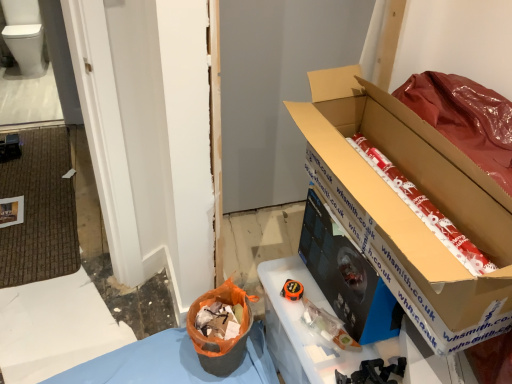
The width and height of the screenshot is (512, 384). Find the location of `cardboard box at right`. cardboard box at right is located at coordinates (409, 208).

Where is `white glossy toilet bowl at upper left`? This screenshot has height=384, width=512. white glossy toilet bowl at upper left is located at coordinates point(26,47).

Measure the distance between point (411,207) and camera.

Point (411,207) and camera are 37.28 inches apart.

The image size is (512, 384). Describe the element at coordinates (423, 208) in the screenshot. I see `red wrapping paper at right` at that location.

Where is `cardboard box at right`? The width and height of the screenshot is (512, 384). cardboard box at right is located at coordinates tap(409, 208).

Is point (29, 68) farther from camera compared to point (459, 233)?

That is True.

Where is `food in front of the white glossy toilet bowl at upper left`? food in front of the white glossy toilet bowl at upper left is located at coordinates (423, 208).

From a real-world perspective, is white glossy toilet bowl at upper left above or below red wrapping paper at right?

white glossy toilet bowl at upper left is situated lower than red wrapping paper at right in the real world.

Does red wrapping paper at right touch white glossy toilet bowl at upper left?

No, red wrapping paper at right is not beside white glossy toilet bowl at upper left.

From a real-world perspective, is red wrapping paper at right positioned under white glossy toilet bowl at upper left based on gravity?

No, from a real-world perspective, red wrapping paper at right is not below white glossy toilet bowl at upper left.

Considering the relative sizes of cardboard box at right and orange fabric bag at lower center in the image provided, is cardboard box at right thinner than orange fabric bag at lower center?

No.

Can you tell me how much cardboard box at right and orange fabric bag at lower center differ in facing direction?

The angular difference between cardboard box at right and orange fabric bag at lower center is 96.5 degrees.

From a real-world perspective, is cardboard box at right positioned above or below orange fabric bag at lower center?

Clearly, from a real-world perspective, cardboard box at right is above orange fabric bag at lower center.

Does cardboard box at right have a larger size compared to orange fabric bag at lower center?

Indeed, cardboard box at right has a larger size compared to orange fabric bag at lower center.

Is cardboard box at right shorter than red wrapping paper at right?

Incorrect, the height of cardboard box at right does not fall short of that of red wrapping paper at right.

From a real-world perspective, is cardboard box at right located higher than red wrapping paper at right?

Correct, in the physical world, cardboard box at right is higher than red wrapping paper at right.

Considering the positions of point (412, 136) and point (383, 176), is point (412, 136) closer or farther from the camera than point (383, 176)?

Point (412, 136).

Looking at this image, measure the distance from cardboard box at right to red wrapping paper at right.

cardboard box at right and red wrapping paper at right are 4.06 inches apart.

Consider the image. Does white glossy toilet bowl at upper left have a larger size compared to orange fabric bag at lower center?

Indeed, white glossy toilet bowl at upper left has a larger size compared to orange fabric bag at lower center.

Does white glossy toilet bowl at upper left have a greater width compared to orange fabric bag at lower center?

Indeed, white glossy toilet bowl at upper left has a greater width compared to orange fabric bag at lower center.

In the scene shown: Is white glossy toilet bowl at upper left turned away from orange fabric bag at lower center?

No, white glossy toilet bowl at upper left is not facing the opposite direction of orange fabric bag at lower center.

Measure the distance from cardboard box at right to white glossy toilet bowl at upper left.

cardboard box at right is 14.93 feet away from white glossy toilet bowl at upper left.

From the image's perspective, is cardboard box at right located above white glossy toilet bowl at upper left?

No.

Is cardboard box at right taller or shorter than white glossy toilet bowl at upper left?

In the image, cardboard box at right appears to be shorter than white glossy toilet bowl at upper left.

Could you tell me if cardboard box at right is turned towards white glossy toilet bowl at upper left?

No, cardboard box at right is not oriented towards white glossy toilet bowl at upper left.

Is orange fabric bag at lower center taller or shorter than cardboard box at right?

In the image, orange fabric bag at lower center appears to be shorter than cardboard box at right.

Which is farther, [206,353] or [416,118]?

Point [206,353]

Based on the photo, is orange fabric bag at lower center aimed at cardboard box at right?

No.

Based on the photo, from a real-world perspective, is orange fabric bag at lower center located higher than cardboard box at right?

Actually, orange fabric bag at lower center is physically below cardboard box at right in the real world.

The height and width of the screenshot is (384, 512). I want to click on toilet bowl above the red wrapping paper at right (from the image's perspective), so click(26, 47).

You are a GUI agent. You are given a task and a screenshot of the screen. Output one action in this format:
    pyautogui.click(x=<x>, y=<y>)
    Task: Click on the food that appears on the right of white glossy toilet bowl at upper left
    The height and width of the screenshot is (384, 512).
    Given the screenshot: What is the action you would take?
    pyautogui.click(x=423, y=208)

Looking at the image, which one is located further to red wrapping paper at right, orange fabric bag at lower center or white glossy toilet bowl at upper left?

Based on the image, white glossy toilet bowl at upper left appears to be further to red wrapping paper at right.

When comparing their distances from white glossy toilet bowl at upper left, does orange fabric bag at lower center or cardboard box at right seem further?

The object further to white glossy toilet bowl at upper left is cardboard box at right.

Estimate the real-world distances between objects in this image. Which object is further from cardboard box at right, red wrapping paper at right or orange fabric bag at lower center?

orange fabric bag at lower center.

Estimate the real-world distances between objects in this image. Which object is further from red wrapping paper at right, orange fabric bag at lower center or cardboard box at right?

orange fabric bag at lower center is positioned further to the anchor red wrapping paper at right.

Looking at this image, which object lies nearer to the anchor point red wrapping paper at right, white glossy toilet bowl at upper left or cardboard box at right?

cardboard box at right is closer to red wrapping paper at right.

From the image, which object appears to be nearer to orange fabric bag at lower center, cardboard box at right or red wrapping paper at right?

cardboard box at right is positioned closer to the anchor orange fabric bag at lower center.

Based on the photo, from the image, which object appears to be farther from white glossy toilet bowl at upper left, cardboard box at right or orange fabric bag at lower center?

cardboard box at right.

From the image, which object appears to be farther from orange fabric bag at lower center, white glossy toilet bowl at upper left or cardboard box at right?

The object further to orange fabric bag at lower center is white glossy toilet bowl at upper left.

At what (x,y) coordinates should I click in order to perform the action: click on recycling bin between red wrapping paper at right and white glossy toilet bowl at upper left along the z-axis. Please return your answer as a coordinate pair (x, y). Image resolution: width=512 pixels, height=384 pixels. Looking at the image, I should click on point(217,338).

The width and height of the screenshot is (512, 384). I want to click on food between cardboard box at right and white glossy toilet bowl at upper left along the z-axis, so click(x=423, y=208).

Find the location of a particular element. recycling bin positioned between cardboard box at right and white glossy toilet bowl at upper left from near to far is located at coordinates (217, 338).

The image size is (512, 384). I want to click on food between cardboard box at right and orange fabric bag at lower center along the z-axis, so click(x=423, y=208).